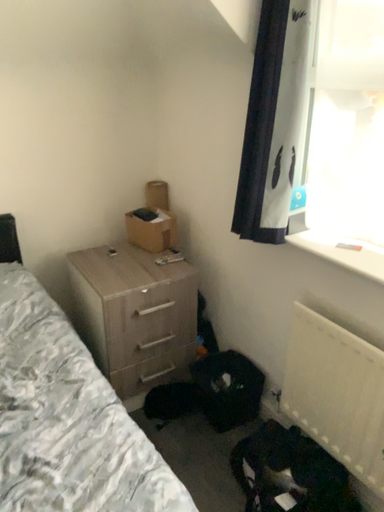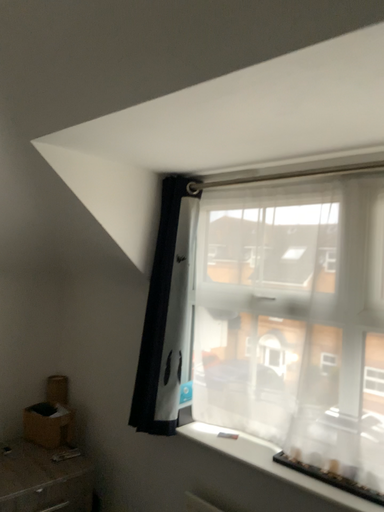
Question: How did the camera likely rotate when shooting the video?

Choices:
 (A) rotated right
 (B) rotated left

Answer: (A)